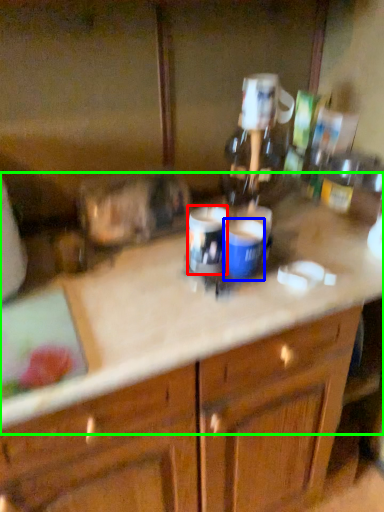
Question: Considering the real-world distances, which object is closest to beverage (highlighted by a red box)? beverage (highlighted by a blue box) or counter top (highlighted by a green box).

Choices:
 (A) beverage
 (B) counter top

Answer: (A)